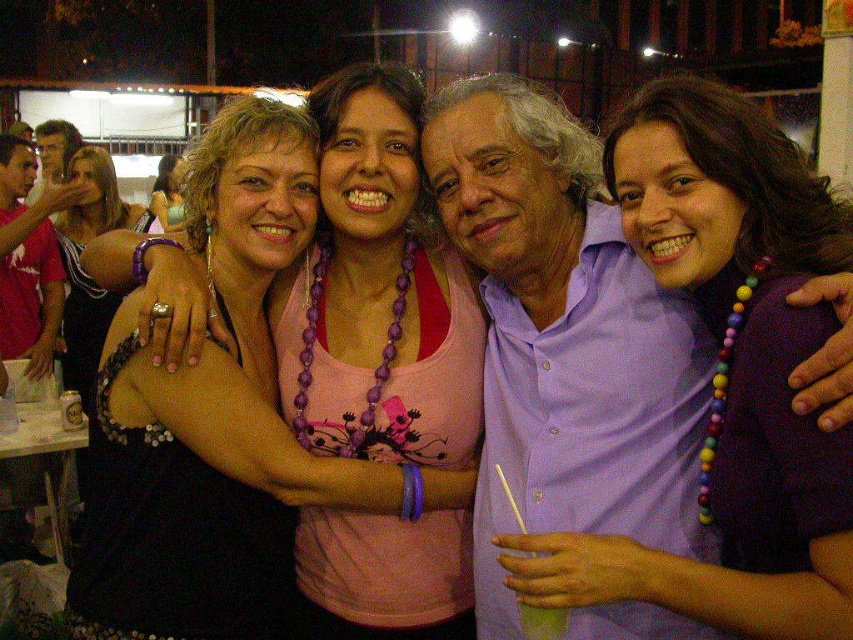
Is pink fabric tank top at center thinner than matte black dress at left?

Incorrect, pink fabric tank top at center's width is not less than matte black dress at left's.

Which is in front, point (250, 317) or point (84, 296)?

Point (250, 317)

Locate an element on the screen. pink fabric tank top at center is located at coordinates (224, 401).

Is point (160, 224) more distant than point (561, 628)?

That is True.

Is matte black dress at center positioned at the back of green translucent cup at lower center?

Yes, matte black dress at center is further from the viewer.

Is point (172, 168) closer to viewer compared to point (540, 625)?

That is False.

Where is `matte black dress at center`? matte black dress at center is located at coordinates (167, 195).

In the scene shown: Is the position of matte black dress at left more distant than that of matte black dress at center?

No, matte black dress at left is in front of matte black dress at center.

How much distance is there between matte black dress at left and matte black dress at center?

matte black dress at left and matte black dress at center are 37.75 inches apart.

What do you see at coordinates (83, 269) in the screenshot?
I see `matte black dress at left` at bounding box center [83, 269].

Image resolution: width=853 pixels, height=640 pixels. I want to click on matte black dress at left, so (x=83, y=269).